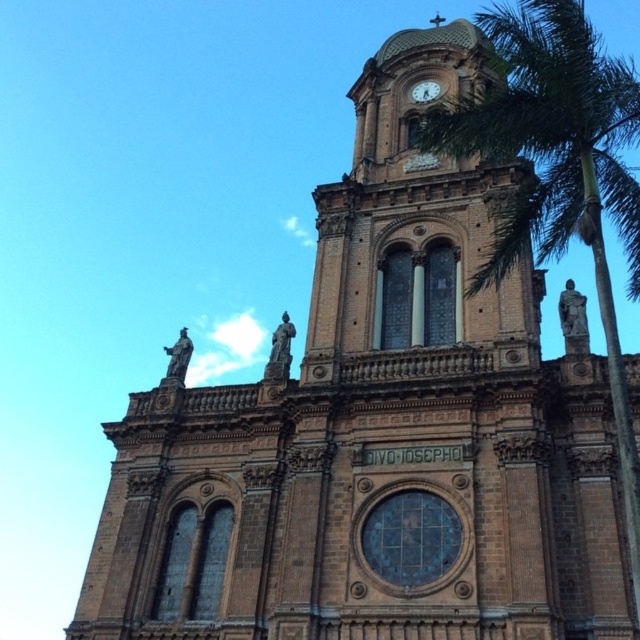
Who is shorter, green leafy palm tree at right or gold metallic clock at upper center?

Standing shorter between the two is gold metallic clock at upper center.

How distant is green leafy palm tree at right from gold metallic clock at upper center?

A distance of 51.42 meters exists between green leafy palm tree at right and gold metallic clock at upper center.

Is point (538, 32) positioned behind point (419, 92)?

No, it is in front of (419, 92).

Locate an element on the screen. green leafy palm tree at right is located at coordinates (557, 168).